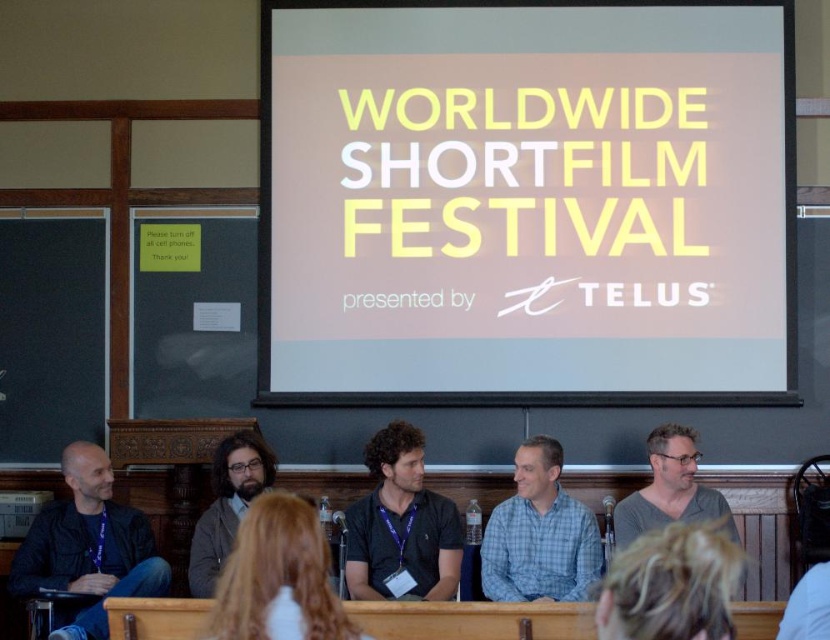
Question: Estimate the real-world distances between objects in this image. Which object is farther from the dark brown hair at center?

Choices:
 (A) blue plaid shirt at center
 (B) blonde hair at lower center
 (C) bearded man with glasses at center

Answer: (A)

Question: Which object is closer to the camera taking this photo?

Choices:
 (A) gray fabric shirt at center
 (B) blackboard at left
 (C) black fabric shirt at center

Answer: (C)

Question: Is blonde hair at lower center behind blue plaid shirt at center?

Choices:
 (A) no
 (B) yes

Answer: (A)

Question: Is the position of blonde hair at lower center more distant than that of gray fabric shirt at center?

Choices:
 (A) yes
 (B) no

Answer: (B)

Question: Is black leather jacket at left closer to the viewer compared to blue plaid shirt at center?

Choices:
 (A) no
 (B) yes

Answer: (B)

Question: Which point is closer to the camera?

Choices:
 (A) gray fabric shirt at center
 (B) dark brown hair at center

Answer: (B)